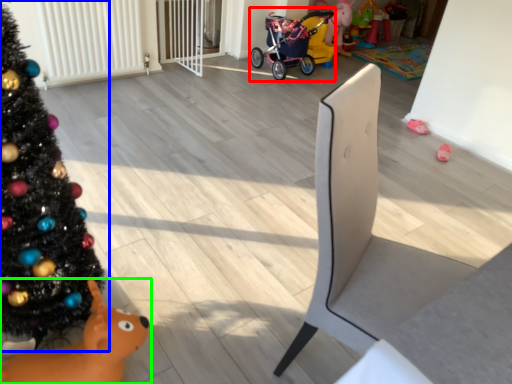
Question: Which object is positioned closest to baby carriage (highlighted by a red box)? Select from christmas tree (highlighted by a blue box) and toy (highlighted by a green box).

Choices:
 (A) christmas tree
 (B) toy

Answer: (A)